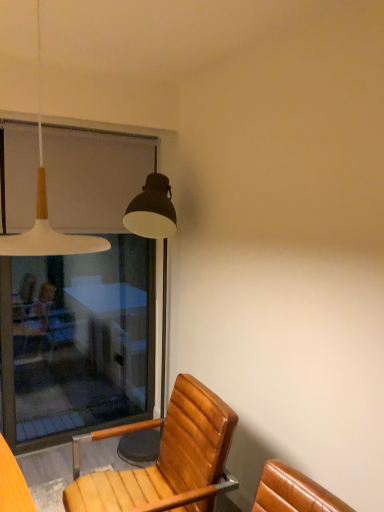
Question: Can you confirm if wooden chair at lower center is thinner than transparent glass screen door at left?

Choices:
 (A) yes
 (B) no

Answer: (B)

Question: From the image's perspective, is wooden chair at lower center above transparent glass screen door at left?

Choices:
 (A) yes
 (B) no

Answer: (B)

Question: Is wooden chair at lower center shorter than transparent glass screen door at left?

Choices:
 (A) yes
 (B) no

Answer: (A)

Question: Considering the relative sizes of wooden chair at lower center and transparent glass screen door at left in the image provided, is wooden chair at lower center taller than transparent glass screen door at left?

Choices:
 (A) no
 (B) yes

Answer: (A)

Question: From the image's perspective, is wooden chair at lower center beneath transparent glass screen door at left?

Choices:
 (A) no
 (B) yes

Answer: (B)

Question: Is wooden chair at lower center outside transparent glass screen door at left?

Choices:
 (A) no
 (B) yes

Answer: (B)

Question: From the image's perspective, does wooden chair at lower center appear lower than white matte pendant light at upper left?

Choices:
 (A) no
 (B) yes

Answer: (B)

Question: From a real-world perspective, is wooden chair at lower center beneath white matte pendant light at upper left?

Choices:
 (A) no
 (B) yes

Answer: (B)

Question: Is wooden chair at lower center facing away from white matte pendant light at upper left?

Choices:
 (A) no
 (B) yes

Answer: (A)

Question: Does wooden chair at lower center have a lesser height compared to white matte pendant light at upper left?

Choices:
 (A) yes
 (B) no

Answer: (B)

Question: Is wooden chair at lower center oriented towards white matte pendant light at upper left?

Choices:
 (A) yes
 (B) no

Answer: (B)

Question: Considering the relative positions of wooden chair at lower center and white matte pendant light at upper left in the image provided, is wooden chair at lower center to the left of white matte pendant light at upper left from the viewer's perspective?

Choices:
 (A) no
 (B) yes

Answer: (A)

Question: From a real-world perspective, is transparent glass screen door at left under white matte pendant light at upper left?

Choices:
 (A) yes
 (B) no

Answer: (A)